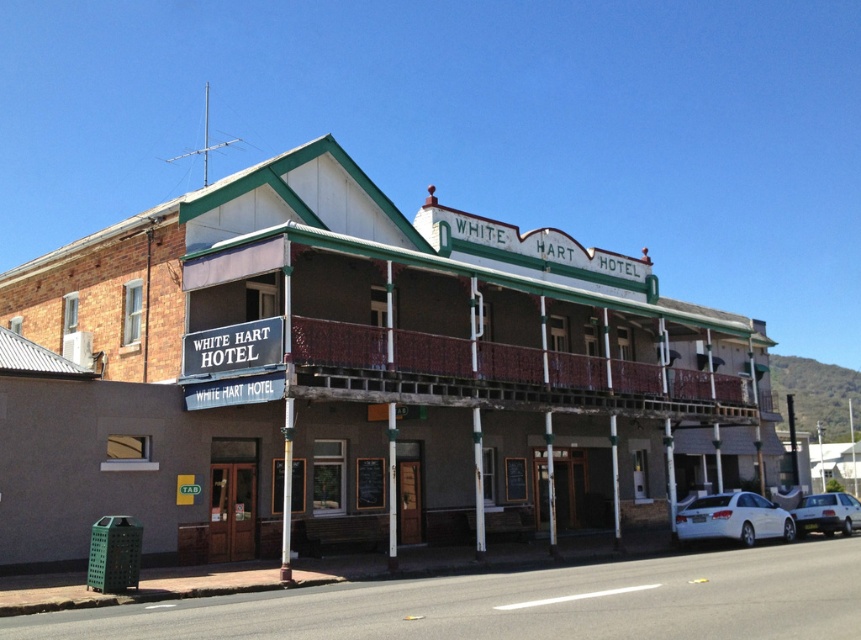
Question: Which object is the farthest from the silver metallic sedan at lower right?

Choices:
 (A) black metal signboard at lower left
 (B) brown textured building at center
 (C) white glossy sedan at lower right

Answer: (A)

Question: Which point is closer to the camera?

Choices:
 (A) (691, 504)
 (B) (197, 372)
 (C) (533, 502)
 (D) (813, 522)

Answer: (B)

Question: Is white glossy sedan at lower right below black metal signboard at lower left?

Choices:
 (A) yes
 (B) no

Answer: (A)

Question: Which point appears closest to the camera in this image?

Choices:
 (A) (209, 358)
 (B) (618, 403)

Answer: (A)

Question: Does brown textured building at center have a lesser width compared to white glossy sedan at lower right?

Choices:
 (A) no
 (B) yes

Answer: (A)

Question: Is brown textured building at center positioned at the back of white glossy sedan at lower right?

Choices:
 (A) yes
 (B) no

Answer: (B)